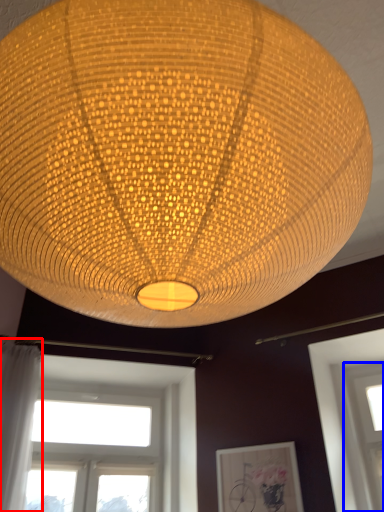
Question: Among these objects, which one is nearest to the camera, curtain (highlighted by a red box) or window (highlighted by a blue box)?

Choices:
 (A) curtain
 (B) window

Answer: (A)